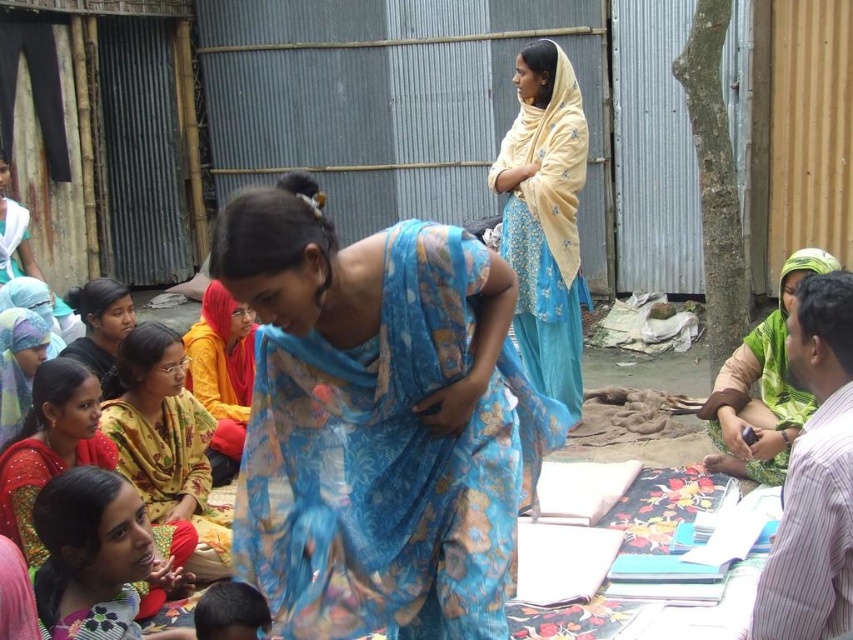
Question: Which point is closer to the camera?

Choices:
 (A) (329, 586)
 (B) (154, 360)
 (C) (55, 301)
 (D) (119, 326)

Answer: (A)

Question: Does floral silk saree at center appear on the right side of yellow fabric at center?

Choices:
 (A) yes
 (B) no

Answer: (A)

Question: Can you confirm if matte yellow saree at lower left is thinner than blue floral saree at center?

Choices:
 (A) no
 (B) yes

Answer: (A)

Question: Which object is farther from the camera taking this photo?

Choices:
 (A) green textured saree at right
 (B) yellow printed fabric at lower left
 (C) floral silk saree at center

Answer: (A)

Question: Can you confirm if floral silk saree at center is positioned below matte yellow scarf at upper left?

Choices:
 (A) yes
 (B) no

Answer: (A)

Question: Which of the following is the closest to the observer?

Choices:
 (A) green textured saree at right
 (B) matte yellow saree at lower left

Answer: (B)